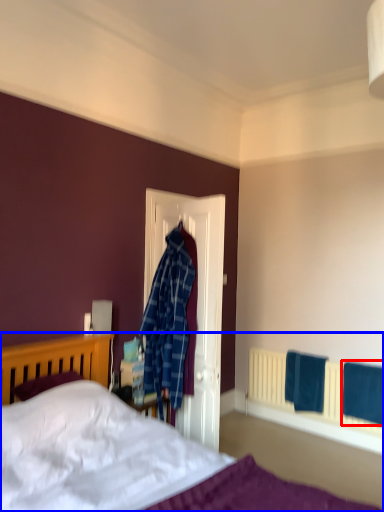
Question: Which point is further to the camera, bath towel (highlighted by a red box) or bed (highlighted by a blue box)?

Choices:
 (A) bath towel
 (B) bed

Answer: (A)